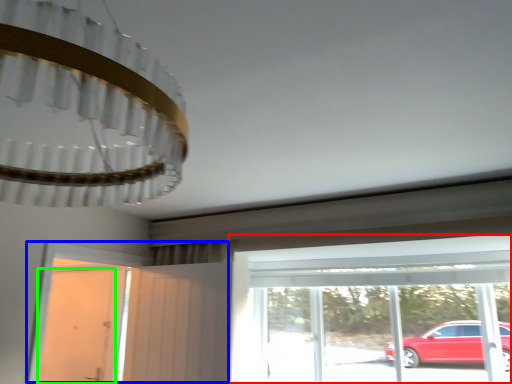
Question: Which object is positioned farthest from window (highlighted by a red box)? Select from door (highlighted by a blue box) and door (highlighted by a green box).

Choices:
 (A) door
 (B) door

Answer: (B)